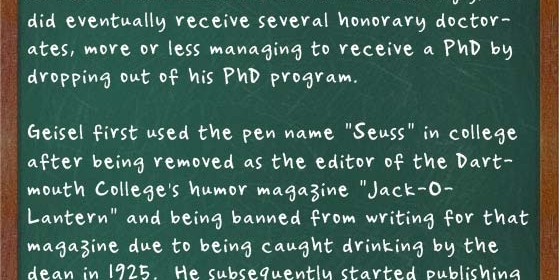
This screenshot has width=559, height=280. Find the location of `chalk board`. chalk board is located at coordinates (118, 100).